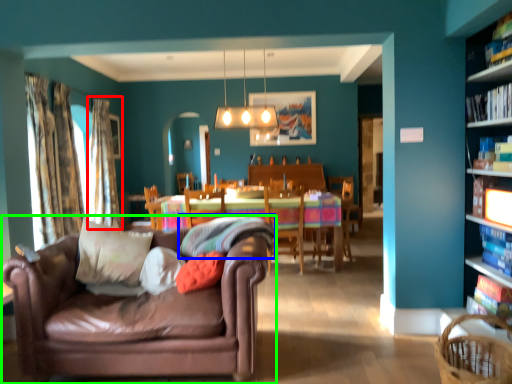
Question: Estimate the real-world distances between objects in this image. Which object is closer to curtain (highlighted by a red box), pillow (highlighted by a blue box) or studio couch (highlighted by a green box)?

Choices:
 (A) pillow
 (B) studio couch

Answer: (A)